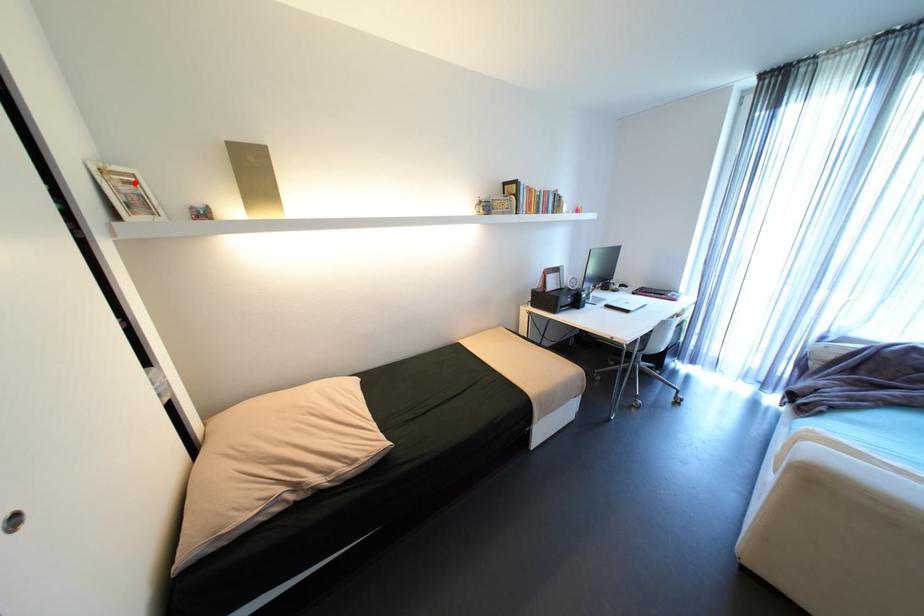
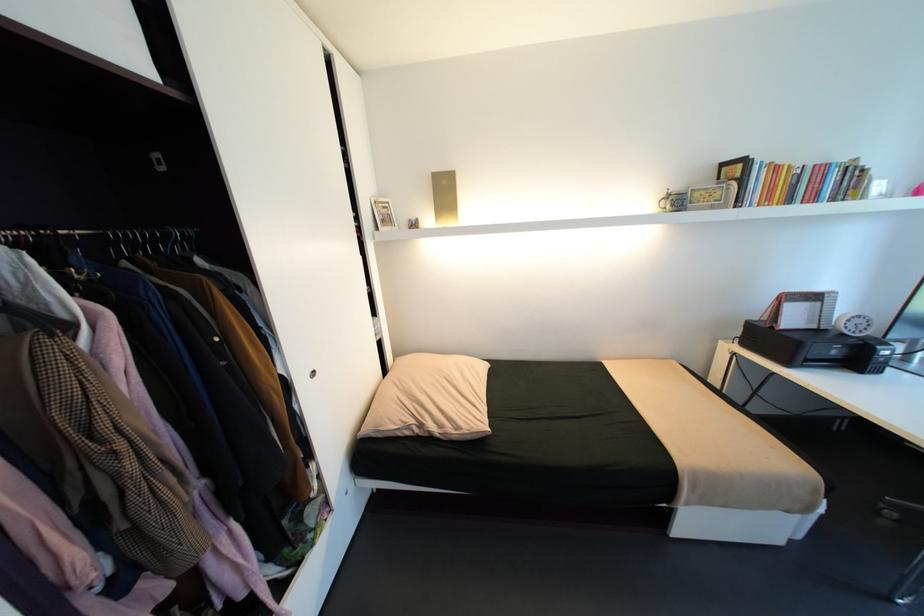
In the second image, find the point that corresponds to the highlighted location in the first image.

(392, 208)